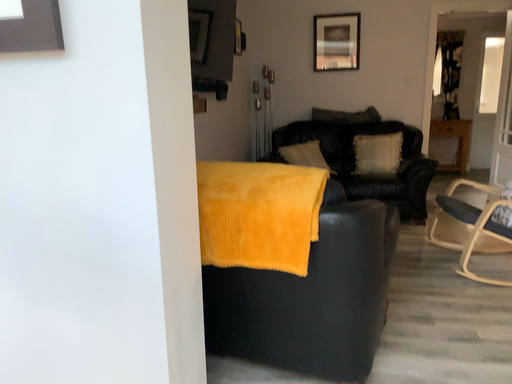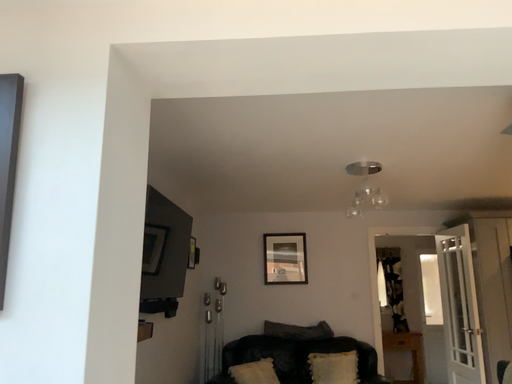
Question: Which way did the camera rotate in the video?

Choices:
 (A) rotated right
 (B) rotated left

Answer: (A)